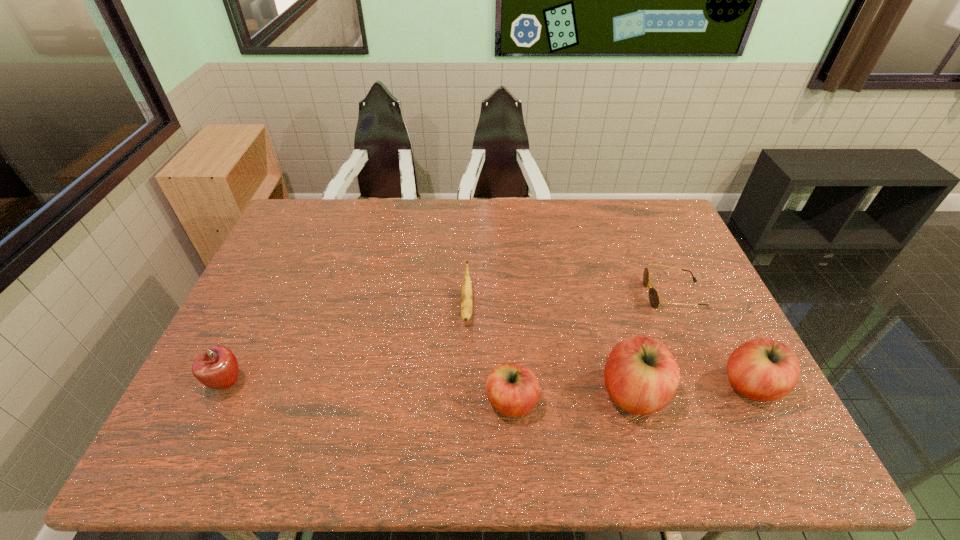
You are a GUI agent. You are given a task and a screenshot of the screen. Output one action in this format:
    pyautogui.click(x=<x>, y=<y>)
    Task: Click on the vacant region located 0.070m on the back of the rightmost apple
    
    Given the screenshot: What is the action you would take?
    pyautogui.click(x=728, y=340)

Locate an element on the screen. vacant space located on the peel of the banana from the top is located at coordinates (464, 408).

This screenshot has height=540, width=960. I want to click on vacant space positioned on the front-facing side of the shortest object, so click(614, 295).

This screenshot has height=540, width=960. Identify the location of vacant area situated on the front-facing side of the shortest object. (550, 295).

Locate an element on the screen. This screenshot has width=960, height=540. vacant space located on the front-facing side of the shortest object is located at coordinates (570, 295).

Where is `vacant space located 0.220m on the back of the leftmost apple`? vacant space located 0.220m on the back of the leftmost apple is located at coordinates (266, 303).

This screenshot has height=540, width=960. Identify the location of object located at the left edge. (217, 367).

What are the coordinates of `apple that is at the right edge` in the screenshot? It's located at (763, 369).

I want to click on sunglasses located at the right edge, so click(654, 298).

Where is `object that is at the near left corner`? This screenshot has width=960, height=540. object that is at the near left corner is located at coordinates (217, 367).